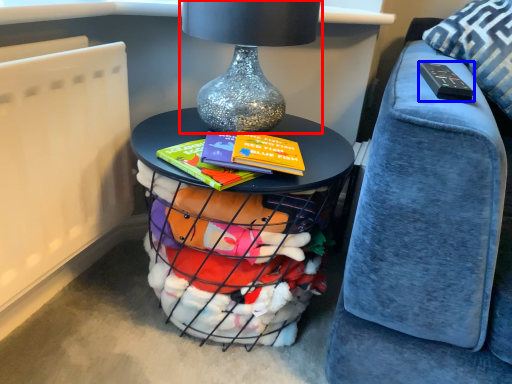
Question: Among these objects, which one is farthest to the camera, table lamp (highlighted by a red box) or remote (highlighted by a blue box)?

Choices:
 (A) table lamp
 (B) remote

Answer: (A)